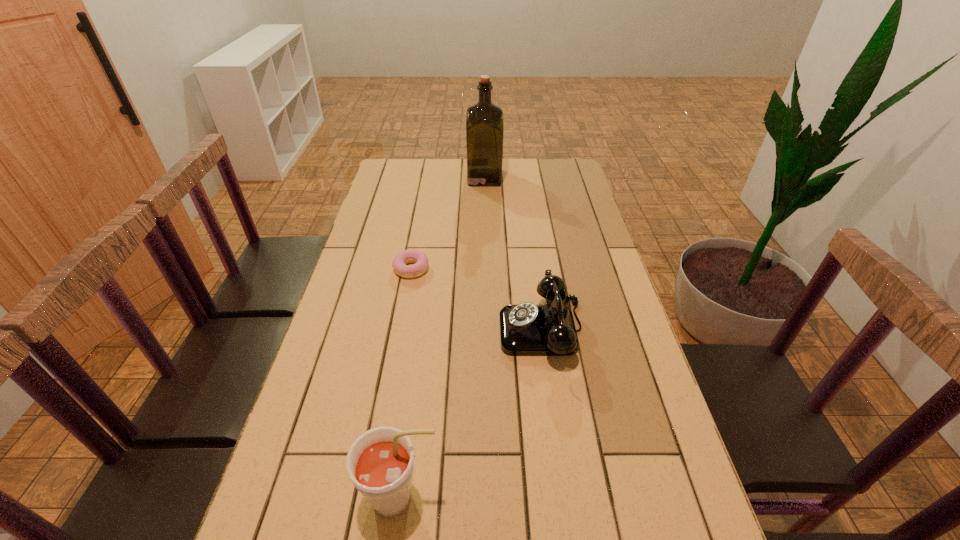
Locate an element on the screen. This screenshot has height=540, width=960. vacant position in the image that satisfies the following two spatial constraints: 1. on the label of the liquor; 2. on the front side of the third nearest object is located at coordinates (486, 269).